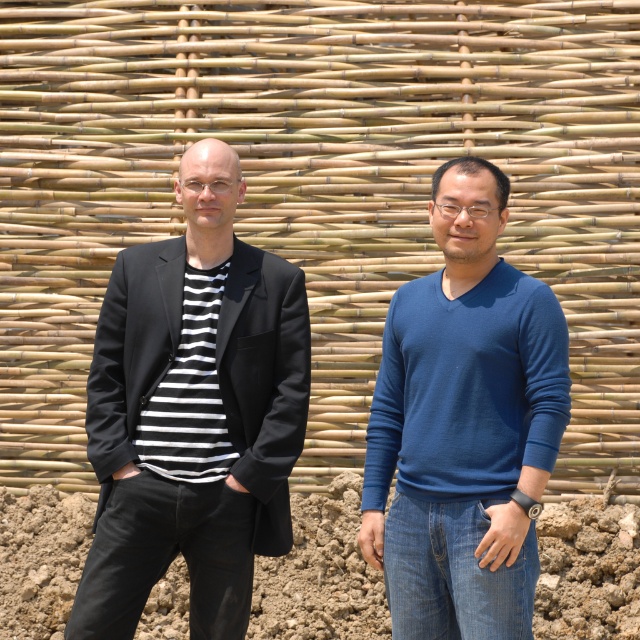
Is black matte blazer at left thinner than black matte suit at left?

In fact, black matte blazer at left might be wider than black matte suit at left.

Does black matte blazer at left have a lesser height compared to black matte suit at left?

No, black matte blazer at left is not shorter than black matte suit at left.

Is point (234, 406) positioned after point (534, 403)?

Yes.

Locate an element on the screen. This screenshot has height=640, width=640. black matte blazer at left is located at coordinates (193, 412).

Identify the location of black matte blazer at left. This screenshot has height=640, width=640. (193, 412).

At what (x,y) coordinates should I click in order to perform the action: click on black matte blazer at left. Please return your answer as a coordinate pair (x, y). Looking at the image, I should click on (193, 412).

Is black matte suit at left closer to the viewer compared to blue smooth sweater at center?

Yes, it is in front of blue smooth sweater at center.

Between point (460, 253) and point (433, 429), which one is positioned behind?

Point (433, 429)

At what (x,y) coordinates should I click in order to perform the action: click on black matte suit at left. Please return your answer as a coordinate pair (x, y). Looking at the image, I should click on (465, 424).